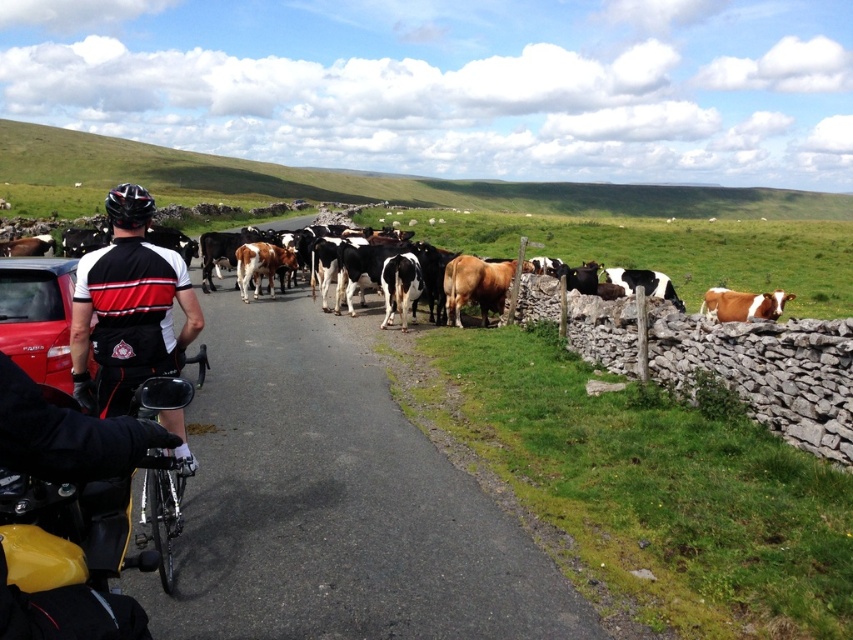
Is point (137, 371) in front of point (28, 353)?

Yes, it is in front of point (28, 353).

Who is positioned more to the right, black and white cycling jersey at center or matte black car at left?

Positioned to the right is black and white cycling jersey at center.

Identify the location of black and white cycling jersey at center. This screenshot has height=640, width=853. (128, 307).

Image resolution: width=853 pixels, height=640 pixels. I want to click on black and white cycling jersey at center, so click(x=128, y=307).